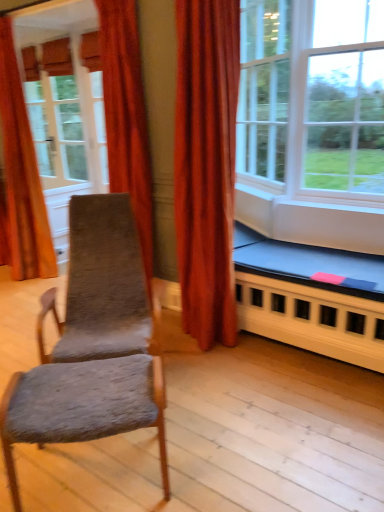
Where is `free space to the right of textured gray fabric rocking chair at left`? Image resolution: width=384 pixels, height=512 pixels. free space to the right of textured gray fabric rocking chair at left is located at coordinates (227, 390).